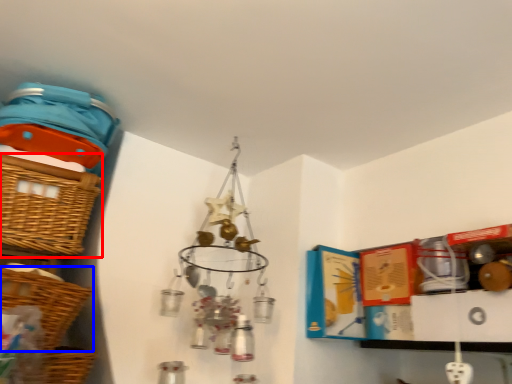
Question: Which point is closer to the camera, basket (highlighted by a red box) or basket (highlighted by a blue box)?

Choices:
 (A) basket
 (B) basket

Answer: (B)